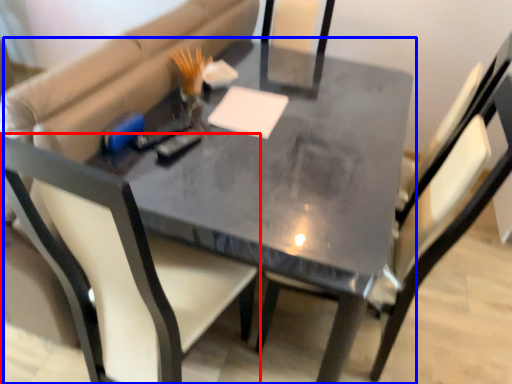
Question: Which of the following is the farthest to the observer, chair (highlighted by a red box) or table (highlighted by a blue box)?

Choices:
 (A) chair
 (B) table

Answer: (B)